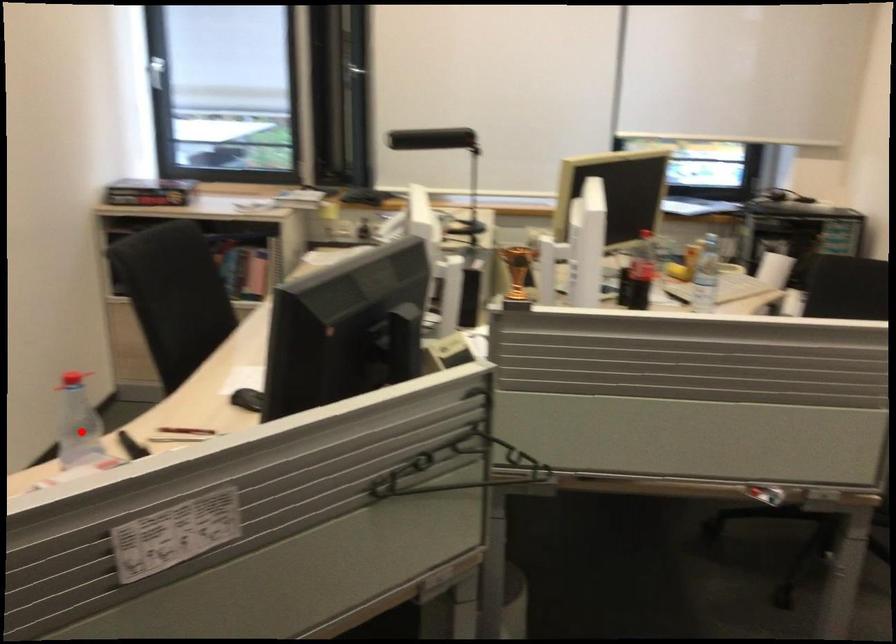
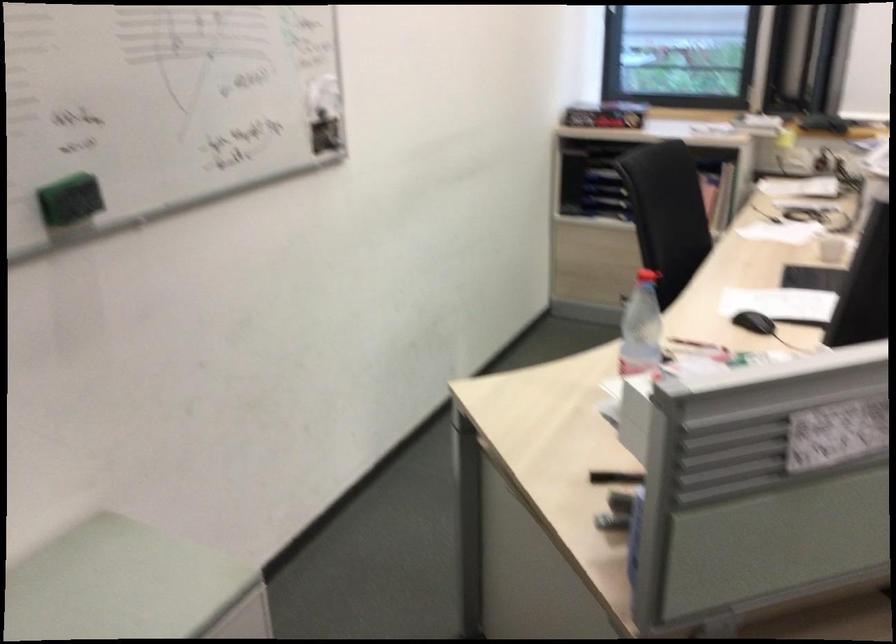
Locate, in the second image, the point that corresponds to the highlighted location in the first image.

(641, 327)